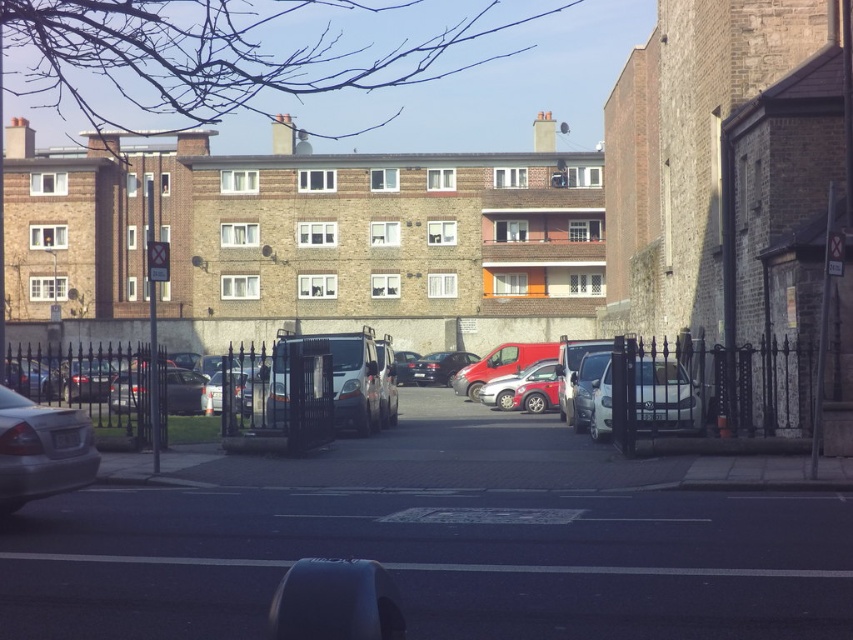
You are a delivery driver who needs to park your vehicle between the silver metallic sedan at lower left and the shiny black sedan at center. The parking space between them is 5 meters long. Can you fit your 4.5 meter long delivery van there?

The distance between the silver metallic sedan at lower left and the shiny black sedan at center is 51.90 meters. Since the parking space is 5 meters long and your van is 4.5 meters long, you can fit your delivery van in the space between them.

You are a delivery person trying to park your 1.8 meters tall delivery van. You see the silver metallic sedan at lower left and the white matte van at center in the parking area. Which vehicle can your van fit between without hitting the black metal fence?

The silver metallic sedan at lower left is taller than the white matte van at center. Since your delivery van is 1.8 meters tall, it cannot fit between the silver metallic sedan at lower left and the black metal fence because the sedan is taller. However, the white matte van at center is shorter, so your van can fit between the white matte van at center and the fence.

You are a delivery person needing to park your van in the parking area. You see the metallic gray parking meter at lower center and the silver metallic sedan at lower left. Which object is wider?

The metallic gray parking meter at lower center is wider than the silver metallic sedan at lower left.